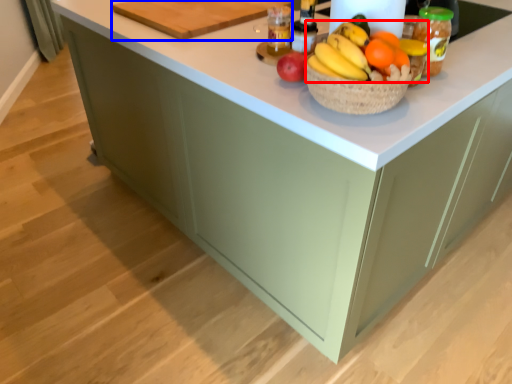
Question: Among these objects, which one is farthest to the camera, grapefruit (highlighted by a red box) or cutting board (highlighted by a blue box)?

Choices:
 (A) grapefruit
 (B) cutting board

Answer: (B)